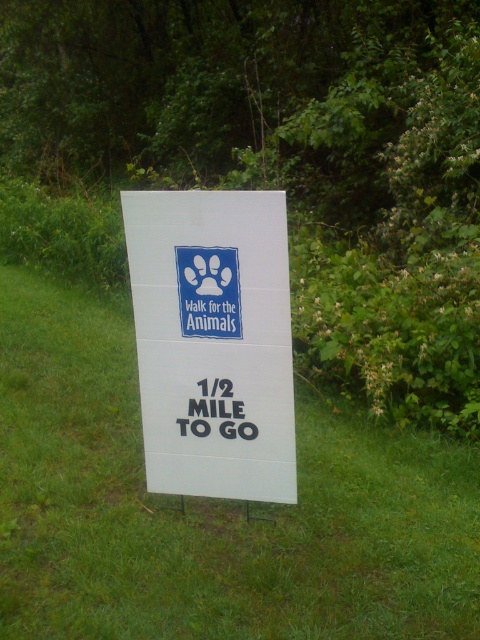
Based on the photo, you are planning to place a new rectangular banner that is 3 feet wide next to the white cardboard sign at center. Given the space available on the green grass at center, will the banner fit without overlapping the sign?

The green grass at center has a larger width than the white cardboard sign at center. Since the banner is 3 feet wide, it can be placed next to the sign on the green grass at center as there is sufficient space available.